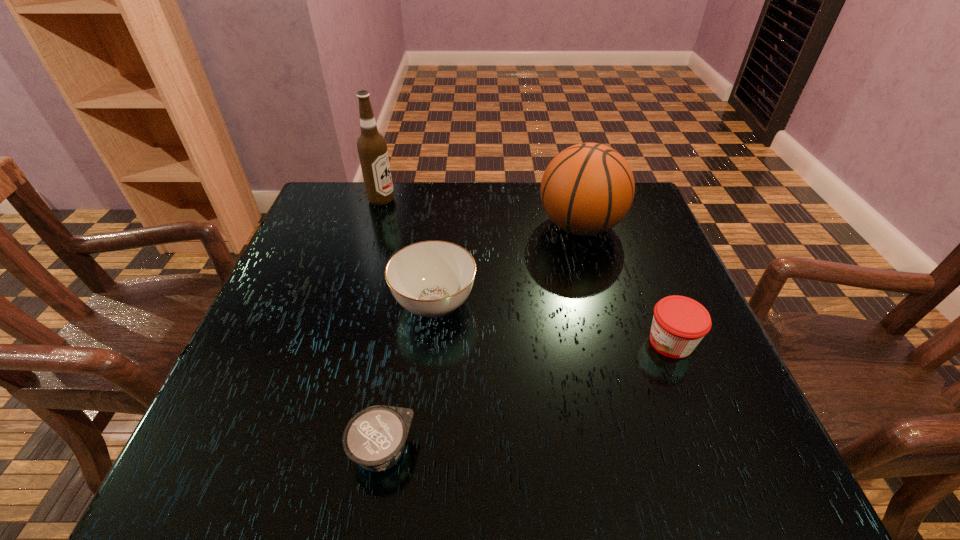
The height and width of the screenshot is (540, 960). Find the location of `object that is the second closest to the yogurt`. object that is the second closest to the yogurt is located at coordinates click(x=679, y=323).

Select which object appears as the third closest to the chinaware. Please provide its 2D coordinates. Your answer should be formatted as a tuple, i.e. [(x, y)], where the tuple contains the x and y coordinates of a point satisfying the conditions above.

[(372, 148)]

Where is `vacant space that satisfies the following two spatial constraints: 1. on the back side of the chinaware; 2. on the left side of the yogurt`? The image size is (960, 540). vacant space that satisfies the following two spatial constraints: 1. on the back side of the chinaware; 2. on the left side of the yogurt is located at coordinates (407, 303).

The height and width of the screenshot is (540, 960). What are the coordinates of `free spot that satisfies the following two spatial constraints: 1. on the label of the tallest object; 2. on the right side of the fourth shortest object` in the screenshot? It's located at (373, 226).

What are the coordinates of `free space that satisfies the following two spatial constraints: 1. on the label of the second tallest object; 2. on the left side of the tallest object` in the screenshot? It's located at (373, 226).

Find the location of `vacant area in the image that satisfies the following two spatial constraints: 1. on the back side of the basketball; 2. on the label of the alcohol`. vacant area in the image that satisfies the following two spatial constraints: 1. on the back side of the basketball; 2. on the label of the alcohol is located at coordinates (573, 200).

Locate an element on the screen. Image resolution: width=960 pixels, height=540 pixels. vacant point that satisfies the following two spatial constraints: 1. on the label of the basketball; 2. on the right side of the alcohol is located at coordinates (373, 226).

Locate an element on the screen. Image resolution: width=960 pixels, height=540 pixels. vacant point that satisfies the following two spatial constraints: 1. on the label of the tallest object; 2. on the back side of the second tallest object is located at coordinates (373, 226).